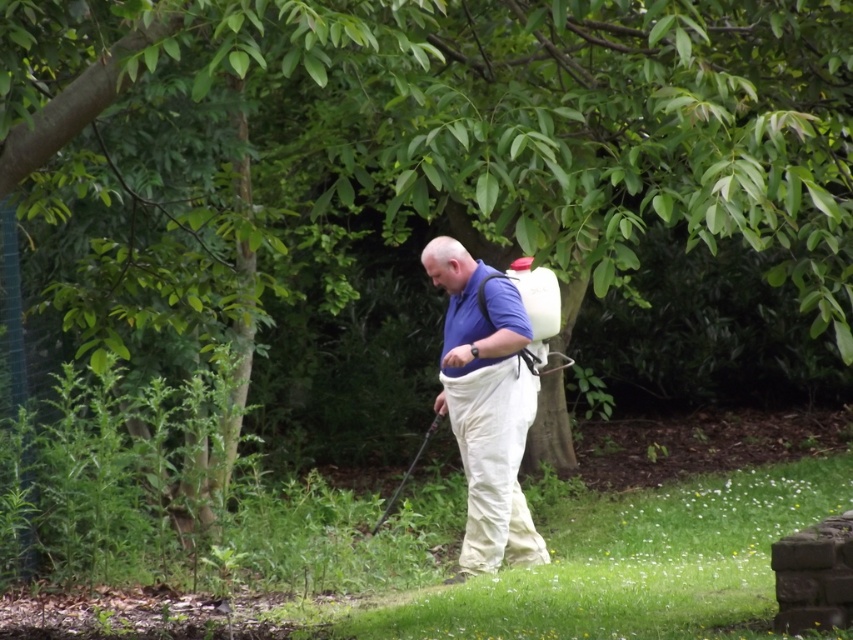
Question: Considering the relative positions of green grass at lower center and blue fabric shirt at center in the image provided, where is green grass at lower center located with respect to blue fabric shirt at center?

Choices:
 (A) below
 (B) above

Answer: (A)

Question: Which object is closer to the camera taking this photo?

Choices:
 (A) blue fabric shirt at center
 (B) green grass at lower center

Answer: (A)

Question: Does green grass at lower center have a greater width compared to blue fabric shirt at center?

Choices:
 (A) yes
 (B) no

Answer: (B)

Question: Which of the following is the closest to the observer?

Choices:
 (A) (479, 340)
 (B) (735, 492)

Answer: (A)

Question: Does green grass at lower center lie behind blue fabric shirt at center?

Choices:
 (A) yes
 (B) no

Answer: (A)